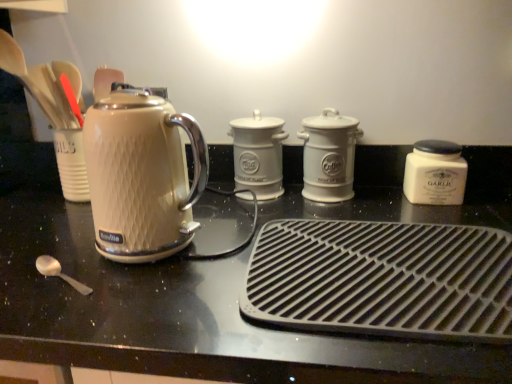
Question: Does matte white kettle at left appear on the left side of white ceramic coffee canister at center, the 3th kitchen appliance viewed from the front?

Choices:
 (A) yes
 (B) no

Answer: (A)

Question: Is matte white kettle at left far away from white ceramic coffee canister at center, acting as the 2th kitchen appliance starting from the back?

Choices:
 (A) yes
 (B) no

Answer: (B)

Question: Considering the relative sizes of matte white kettle at left and white ceramic coffee canister at center, the 3th kitchen appliance viewed from the front, in the image provided, is matte white kettle at left taller than white ceramic coffee canister at center, the 3th kitchen appliance viewed from the front,?

Choices:
 (A) yes
 (B) no

Answer: (A)

Question: Is matte white kettle at left smaller than white ceramic coffee canister at center, acting as the 2th kitchen appliance starting from the back?

Choices:
 (A) yes
 (B) no

Answer: (B)

Question: Is matte white kettle at left in front of white ceramic coffee canister at center, acting as the 2th kitchen appliance starting from the back?

Choices:
 (A) yes
 (B) no

Answer: (A)

Question: In terms of height, does matte cream kettle at left look taller or shorter compared to white ceramic jar at right, acting as the 2th kitchen appliance starting from the front?

Choices:
 (A) tall
 (B) short

Answer: (A)

Question: In terms of size, does matte cream kettle at left appear bigger or smaller than white ceramic jar at right, which is counted as the third kitchen appliance, starting from the back?

Choices:
 (A) small
 (B) big

Answer: (B)

Question: Is matte cream kettle at left inside the boundaries of white ceramic jar at right, which is counted as the third kitchen appliance, starting from the back, or outside?

Choices:
 (A) inside
 (B) outside

Answer: (B)

Question: Based on their positions, is matte cream kettle at left located to the left or right of white ceramic jar at right, which is counted as the third kitchen appliance, starting from the back?

Choices:
 (A) left
 (B) right

Answer: (A)

Question: Considering their positions, is matte white kettle at left located in front of or behind white ceramic canister at center, placed as the 1th kitchen appliance when sorted from back to front?

Choices:
 (A) front
 (B) behind

Answer: (A)

Question: Is matte white kettle at left wider or thinner than white ceramic canister at center, arranged as the fourth kitchen appliance when viewed from the front?

Choices:
 (A) thin
 (B) wide

Answer: (B)

Question: From the image's perspective, relative to white ceramic canister at center, placed as the 1th kitchen appliance when sorted from back to front, is matte white kettle at left above or below?

Choices:
 (A) below
 (B) above

Answer: (A)

Question: Considering the relative positions of matte white kettle at left and white ceramic canister at center, arranged as the fourth kitchen appliance when viewed from the front, in the image provided, is matte white kettle at left to the left or to the right of white ceramic canister at center, arranged as the fourth kitchen appliance when viewed from the front,?

Choices:
 (A) left
 (B) right

Answer: (A)

Question: Is point (117, 301) closer or farther from the camera than point (297, 251)?

Choices:
 (A) closer
 (B) farther

Answer: (A)

Question: Considering their positions, is matte white kettle at left located in front of or behind black rubber mat at center, which is the first kitchen appliance from front to back?

Choices:
 (A) front
 (B) behind

Answer: (A)